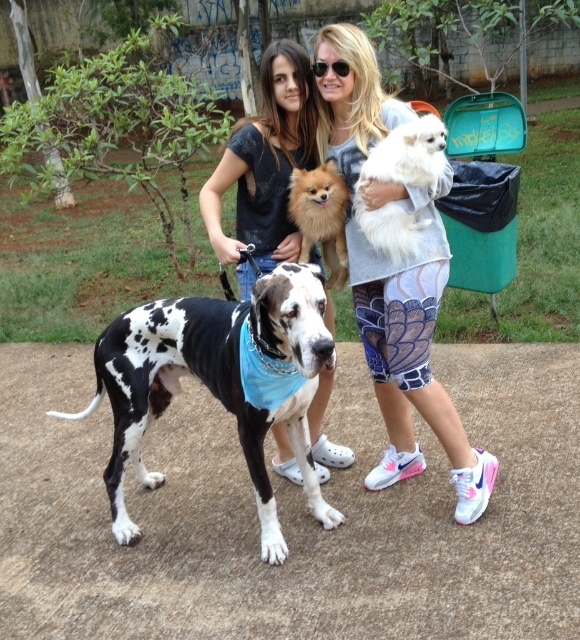
Can you confirm if matte black shirt at center is shorter than white fluffy dog at center?

In fact, matte black shirt at center may be taller than white fluffy dog at center.

Which is above, matte black shirt at center or white fluffy dog at center?

Positioned higher is matte black shirt at center.

The width and height of the screenshot is (580, 640). Describe the element at coordinates (264, 166) in the screenshot. I see `matte black shirt at center` at that location.

Identify the location of matte black shirt at center. (264, 166).

Is matte black shirt at center wider than fuzzy brown dog at center?

Yes, matte black shirt at center is wider than fuzzy brown dog at center.

Between point (298, 51) and point (310, 216), which one is positioned behind?

Point (298, 51)

Locate an element on the screen. matte black shirt at center is located at coordinates (264, 166).

Does white printed leggings at center appear under white fluffy dog at center?

Correct, white printed leggings at center is located below white fluffy dog at center.

Can you confirm if white printed leggings at center is bigger than white fluffy dog at center?

Yes, white printed leggings at center is bigger than white fluffy dog at center.

The image size is (580, 640). Find the location of `white printed leggings at center`. white printed leggings at center is located at coordinates (411, 352).